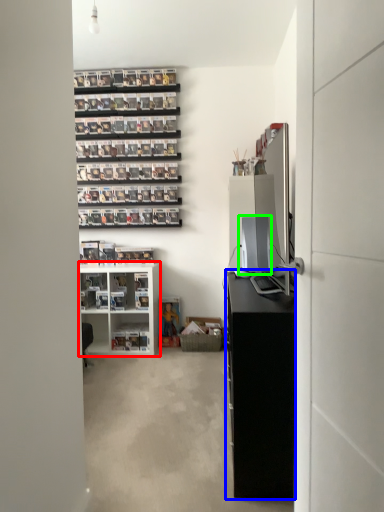
Question: Which is farther away from shelf (highlighted by a red box)? cabinetry (highlighted by a blue box) or desktop computer (highlighted by a green box)?

Choices:
 (A) cabinetry
 (B) desktop computer

Answer: (A)